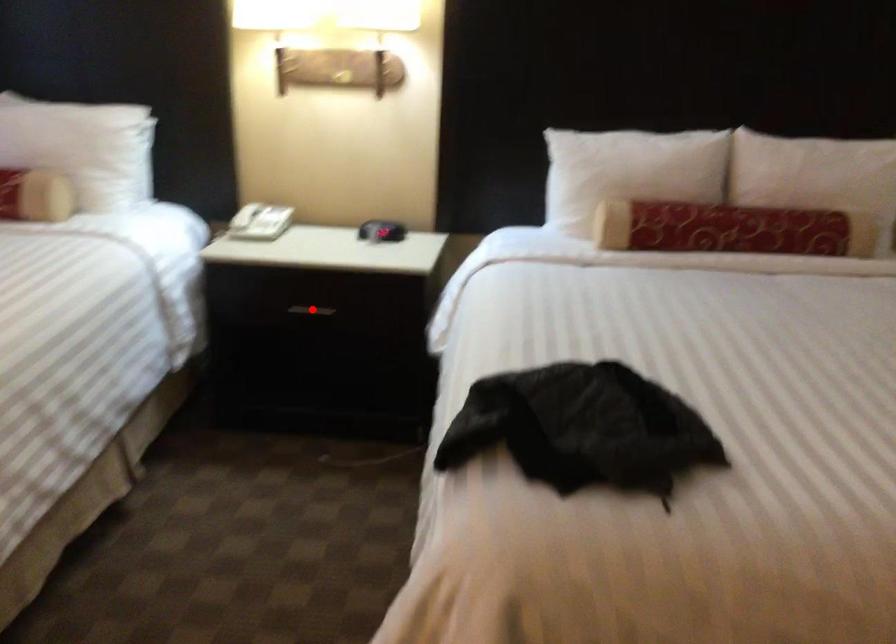
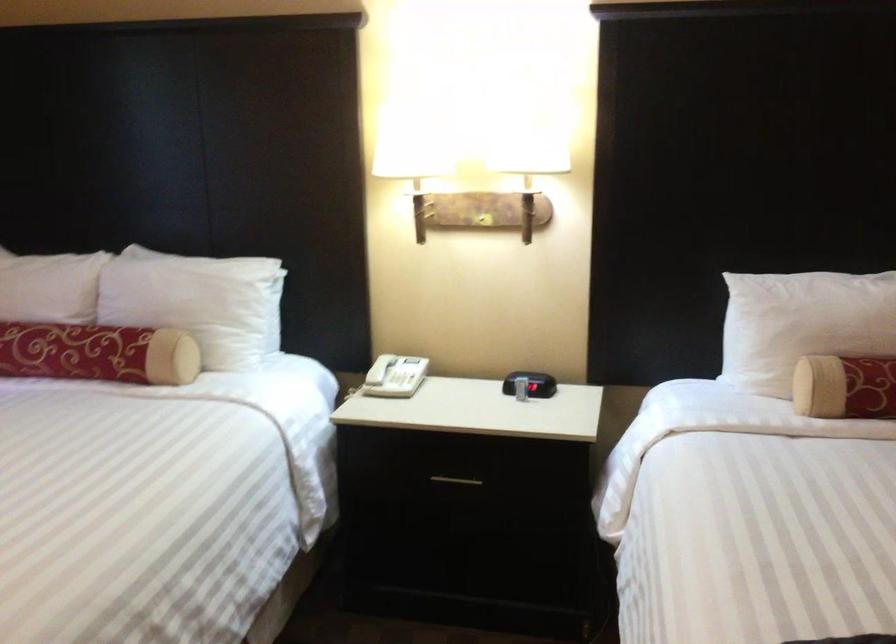
Question: I am providing you with two images of the same scene from different viewpoints. Image1 has a red point marked. In image2, the corresponding 3D location appears at what relative position? Reply with the corresponding letter.

Choices:
 (A) Closer
 (B) Farther

Answer: (A)